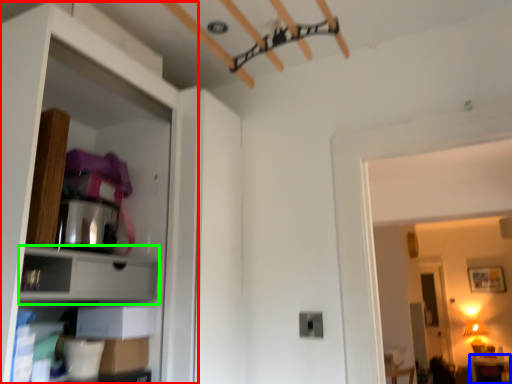
Question: Which is farther away from dresser (highlighted by a red box)? furniture (highlighted by a blue box) or cabinet (highlighted by a green box)?

Choices:
 (A) furniture
 (B) cabinet

Answer: (A)